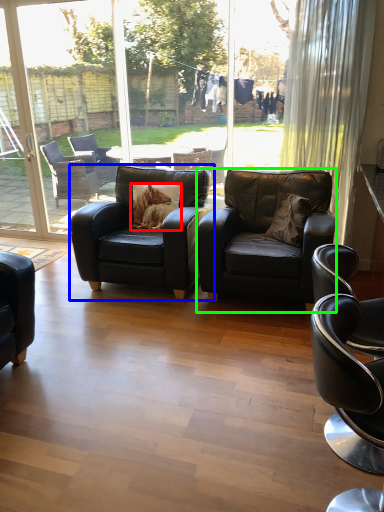
Question: Which is nearer to the pillow (highlighted by a red box)? chair (highlighted by a blue box) or chair (highlighted by a green box).

Choices:
 (A) chair
 (B) chair

Answer: (A)